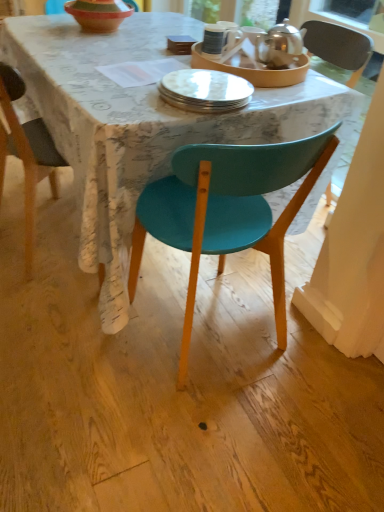
I want to click on free region on the left part of teal plastic chair at center, so click(87, 338).